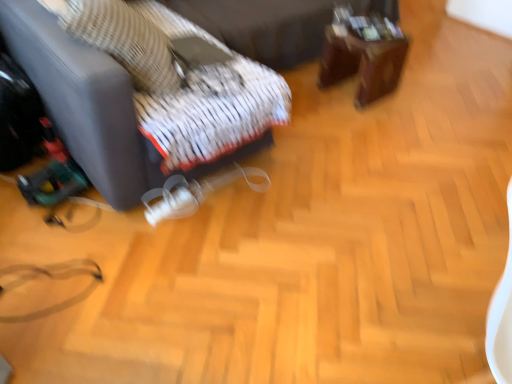
This screenshot has height=384, width=512. Find the location of `blank space above brown wooden table at upper right (from a real-world perspective)`. blank space above brown wooden table at upper right (from a real-world perspective) is located at coordinates (364, 38).